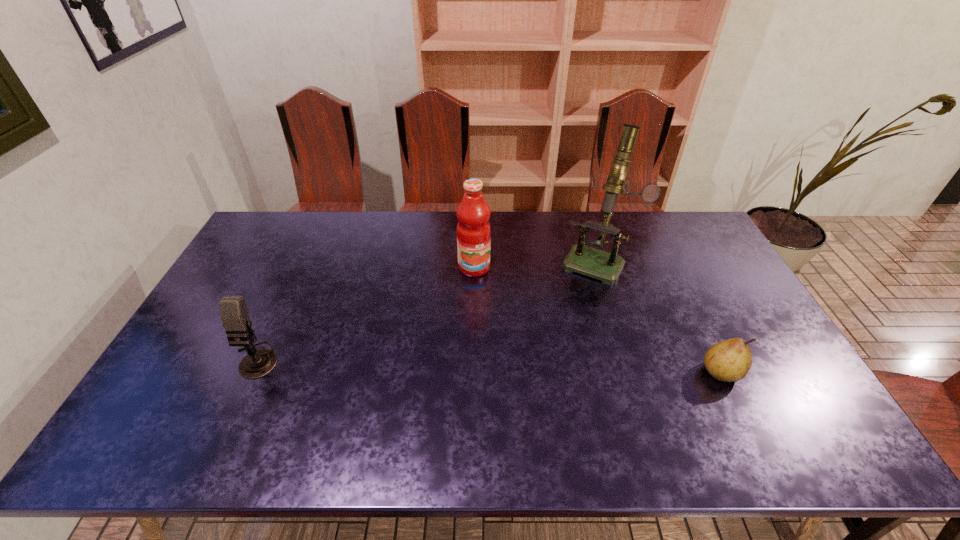
The width and height of the screenshot is (960, 540). Identify the location of free space located 0.340m on the front label of the fruit juice. (511, 359).

I want to click on vacant space located on the front label of the fruit juice, so click(x=482, y=288).

The height and width of the screenshot is (540, 960). I want to click on vacant region located at the eyepiece of the third object from left to right, so click(564, 321).

The height and width of the screenshot is (540, 960). In order to click on vacant space located at the eyepiece of the third object from left to right in this screenshot , I will do `click(548, 352)`.

This screenshot has height=540, width=960. Find the location of `free space located at the eyepiece of the third object from left to right`. free space located at the eyepiece of the third object from left to right is located at coordinates (554, 342).

Identify the location of object that is at the far edge. This screenshot has height=540, width=960. (592, 262).

Identify the location of object positioned at the near edge. (730, 360).

Where is `object that is at the left edge`? Image resolution: width=960 pixels, height=540 pixels. object that is at the left edge is located at coordinates (234, 313).

At what (x,y) coordinates should I click in order to perform the action: click on object present at the right edge. Please return your answer as a coordinate pair (x, y). This screenshot has height=540, width=960. Looking at the image, I should click on (730, 360).

The height and width of the screenshot is (540, 960). Find the location of `object present at the near right corner`. object present at the near right corner is located at coordinates [x=730, y=360].